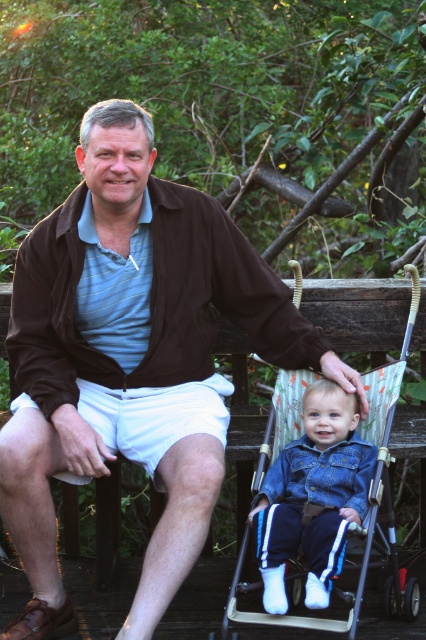
Question: Based on their relative distances, which object is farther from the white cotton shorts at lower center?

Choices:
 (A) denim jacket at center
 (B) matte brown jacket at center

Answer: (A)

Question: Does denim jacket at center have a greater width compared to white cotton shorts at lower center?

Choices:
 (A) no
 (B) yes

Answer: (A)

Question: Can you confirm if matte brown jacket at center is smaller than denim jacket at center?

Choices:
 (A) yes
 (B) no

Answer: (B)

Question: Which point is farther to the camera?

Choices:
 (A) (377, 468)
 (B) (111, 440)
 (C) (264, 515)

Answer: (B)

Question: Which of the following is the closest to the observer?

Choices:
 (A) matte brown jacket at center
 (B) denim jacket at center
 (C) denim fabric stroller at lower center
 (D) white cotton shorts at lower center

Answer: (C)

Question: Is denim jacket at center smaller than denim fabric stroller at lower center?

Choices:
 (A) no
 (B) yes

Answer: (B)